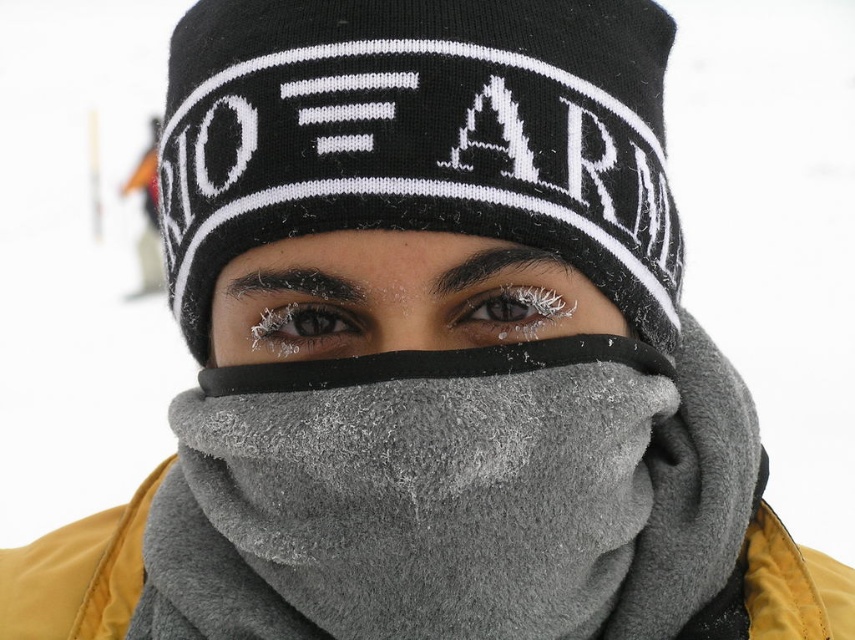
Question: Among these points, which one is farthest from the camera?

Choices:
 (A) (668, 253)
 (B) (248, 358)
 (C) (570, 452)
 (D) (335, 307)

Answer: (A)

Question: Can you confirm if frosted glass eye at center is positioned to the right of icy frost eyelashes at center?

Choices:
 (A) no
 (B) yes

Answer: (A)

Question: Which object is farther from the camera taking this photo?

Choices:
 (A) frosted skin at center
 (B) gray fleece scarf at center
 (C) frosted glass eye at center
 (D) frosted gray scarf at center

Answer: (C)

Question: Estimate the real-world distances between objects in this image. Which object is farther from the frosted skin at center?

Choices:
 (A) icy frost eyelashes at center
 (B) frosted gray scarf at center
 (C) gray fleece scarf at center

Answer: (C)

Question: Where is frosted gray scarf at center located in relation to icy frost eyelashes at center in the image?

Choices:
 (A) left
 (B) right

Answer: (A)

Question: Can you confirm if yellow fleece jacket at center is positioned below frosted skin at center?

Choices:
 (A) no
 (B) yes

Answer: (B)